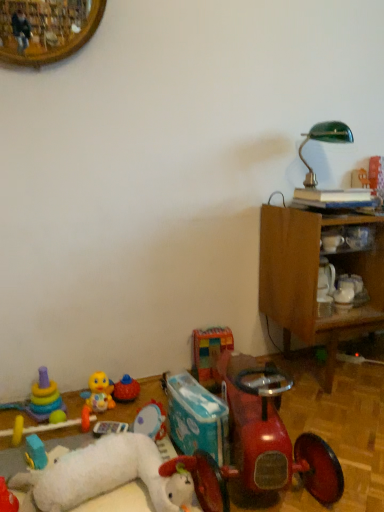
Where is `vacant space underneath wooden cabinet at right (from a real-world perspective)`? vacant space underneath wooden cabinet at right (from a real-world perspective) is located at coordinates pyautogui.click(x=339, y=373).